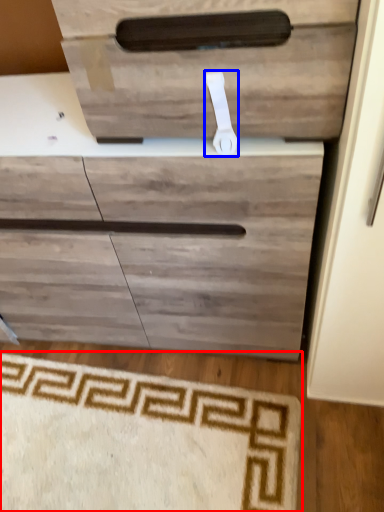
Question: Which object is further to the camera taking this photo, doormat (highlighted by a red box) or door handle (highlighted by a blue box)?

Choices:
 (A) doormat
 (B) door handle

Answer: (A)